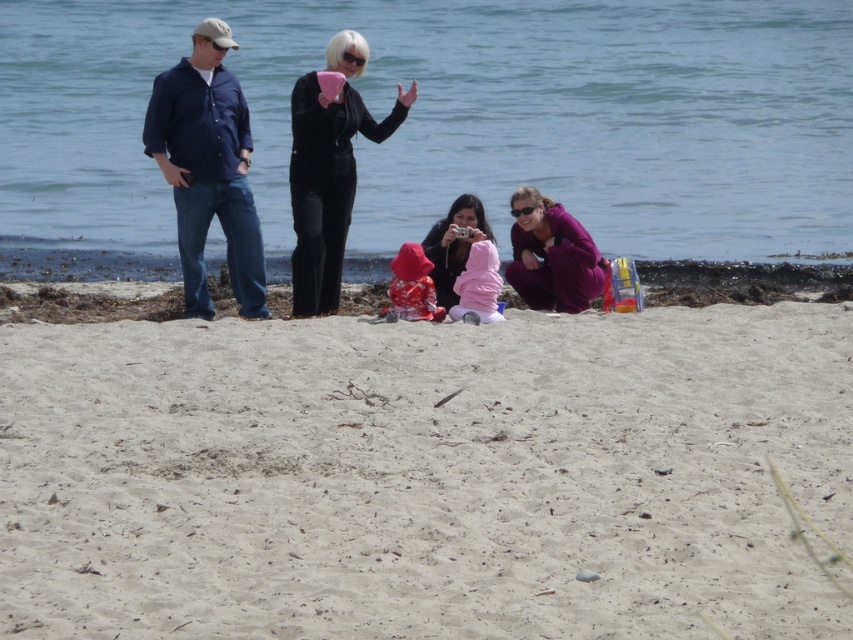
Between blue water at upper center and purple matte jacket at lower center, which one is positioned lower?

Positioned lower is purple matte jacket at lower center.

Where is `blue water at upper center`? The image size is (853, 640). blue water at upper center is located at coordinates (457, 118).

Find the location of a particular element. The image size is (853, 640). blue water at upper center is located at coordinates (457, 118).

Which is more to the left, blue water at upper center or pink fleece jacket at center?

Positioned to the left is blue water at upper center.

Is blue water at upper center to the right of pink fleece jacket at center from the viewer's perspective?

No, blue water at upper center is not to the right of pink fleece jacket at center.

Describe the element at coordinates (457, 118) in the screenshot. The height and width of the screenshot is (640, 853). I see `blue water at upper center` at that location.

Image resolution: width=853 pixels, height=640 pixels. I want to click on blue water at upper center, so click(457, 118).

Is matte black outfit at center further to camera compared to matte black camera at center?

Yes, it is.

Describe the element at coordinates (326, 182) in the screenshot. I see `matte black outfit at center` at that location.

Which is behind, point (334, 104) or point (490, 228)?

The point (490, 228) is more distant.

This screenshot has width=853, height=640. In order to click on matte black outfit at center in this screenshot , I will do `click(326, 182)`.